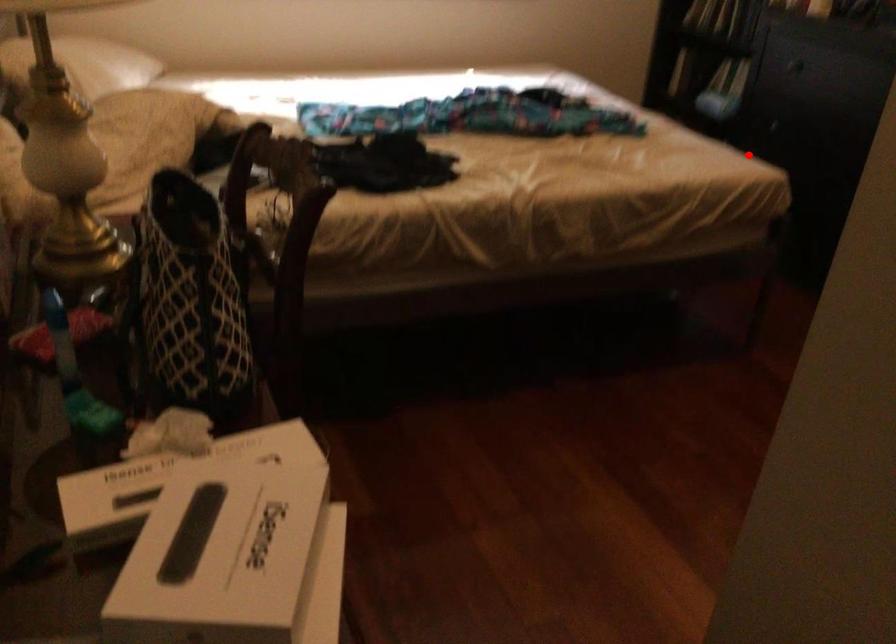
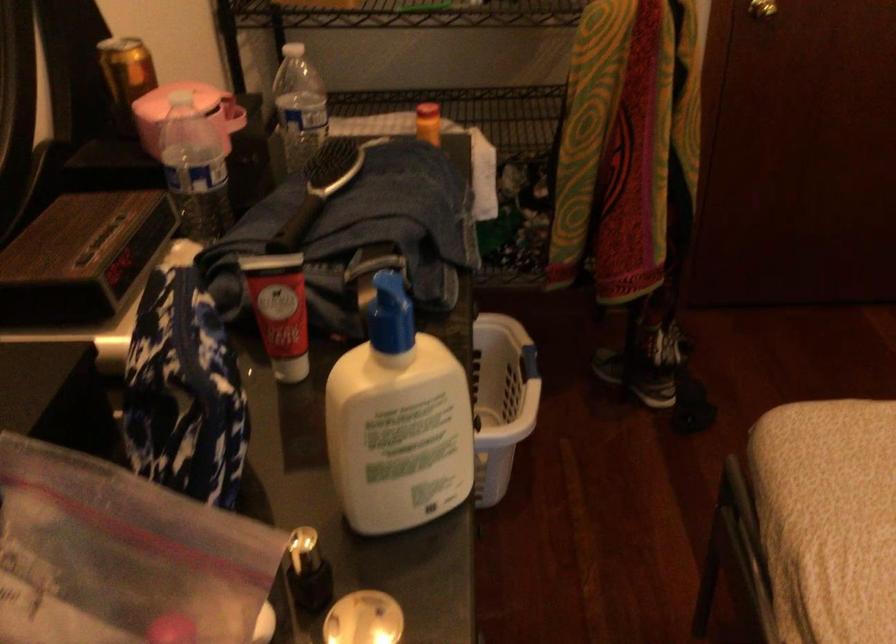
Locate, in the second image, the point that corresponds to the highlighted location in the first image.

(828, 488)